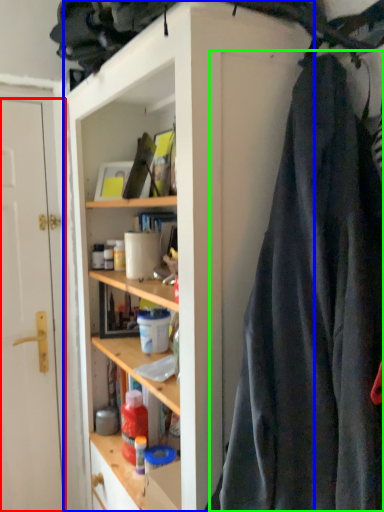
Question: Which is nearer to the door (highlighted by a red box)? cabinetry (highlighted by a blue box) or clothing (highlighted by a green box).

Choices:
 (A) cabinetry
 (B) clothing

Answer: (A)